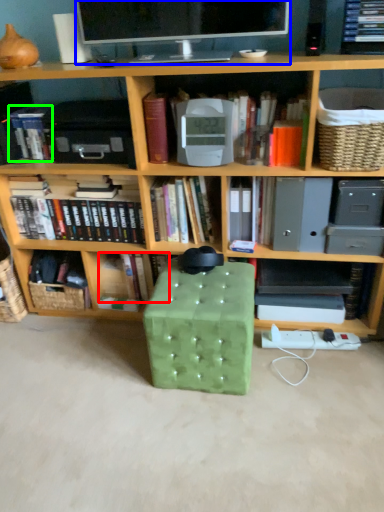
Question: Which object is the farthest from book (highlighted by a red box)? Choose among these: television (highlighted by a blue box) or book (highlighted by a green box).

Choices:
 (A) television
 (B) book

Answer: (A)